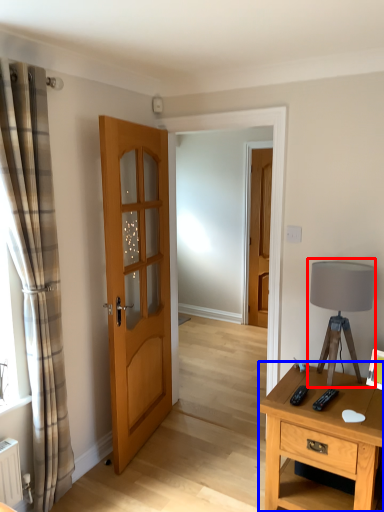
Question: Which object is further to the camera taking this photo, table lamp (highlighted by a red box) or nightstand (highlighted by a blue box)?

Choices:
 (A) table lamp
 (B) nightstand

Answer: (A)